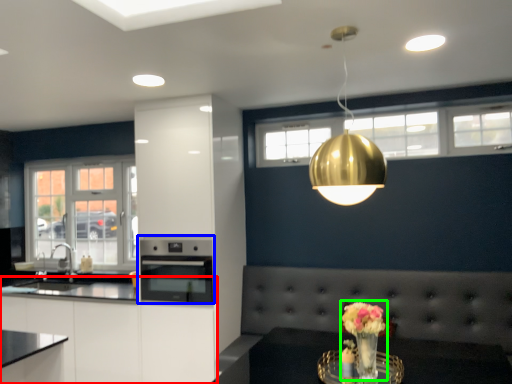
Question: Based on their relative distances, which object is farther from cabinetry (highlighted by a red box)? Choose from oven (highlighted by a blue box) and floral arrangement (highlighted by a green box).

Choices:
 (A) oven
 (B) floral arrangement

Answer: (B)